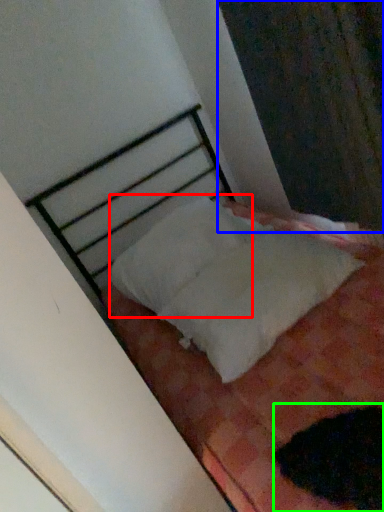
Question: Based on their relative distances, which object is farther from pillow (highlighted by a red box)? Choose from curtain (highlighted by a blue box) and animal (highlighted by a green box).

Choices:
 (A) curtain
 (B) animal

Answer: (B)